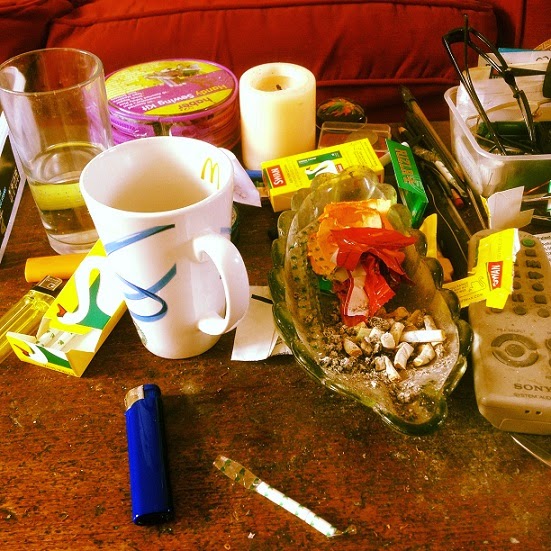
The image size is (551, 551). Identify the location of remote. (533, 323).